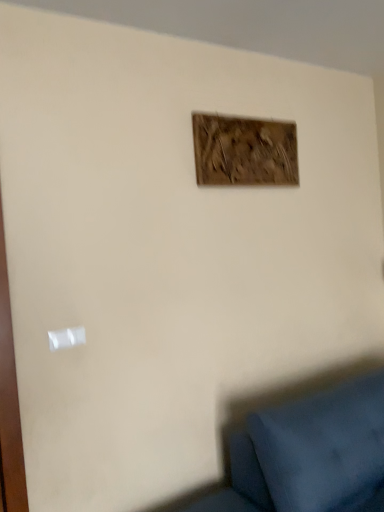
Question: In terms of width, does wooden frame at upper center look wider or thinner when compared to white plastic light switch at lower left?

Choices:
 (A) wide
 (B) thin

Answer: (A)

Question: From the image's perspective, is wooden frame at upper center located above or below white plastic light switch at lower left?

Choices:
 (A) below
 (B) above

Answer: (B)

Question: Is wooden frame at upper center inside or outside of white plastic light switch at lower left?

Choices:
 (A) outside
 (B) inside

Answer: (A)

Question: In terms of size, does white plastic light switch at lower left appear bigger or smaller than wooden frame at upper center?

Choices:
 (A) small
 (B) big

Answer: (A)

Question: From a real-world perspective, relative to wooden frame at upper center, is white plastic light switch at lower left vertically above or below?

Choices:
 (A) above
 (B) below

Answer: (B)

Question: Considering the positions of white plastic light switch at lower left and wooden frame at upper center in the image, is white plastic light switch at lower left taller or shorter than wooden frame at upper center?

Choices:
 (A) tall
 (B) short

Answer: (B)

Question: Is white plastic light switch at lower left inside or outside of wooden frame at upper center?

Choices:
 (A) outside
 (B) inside

Answer: (A)